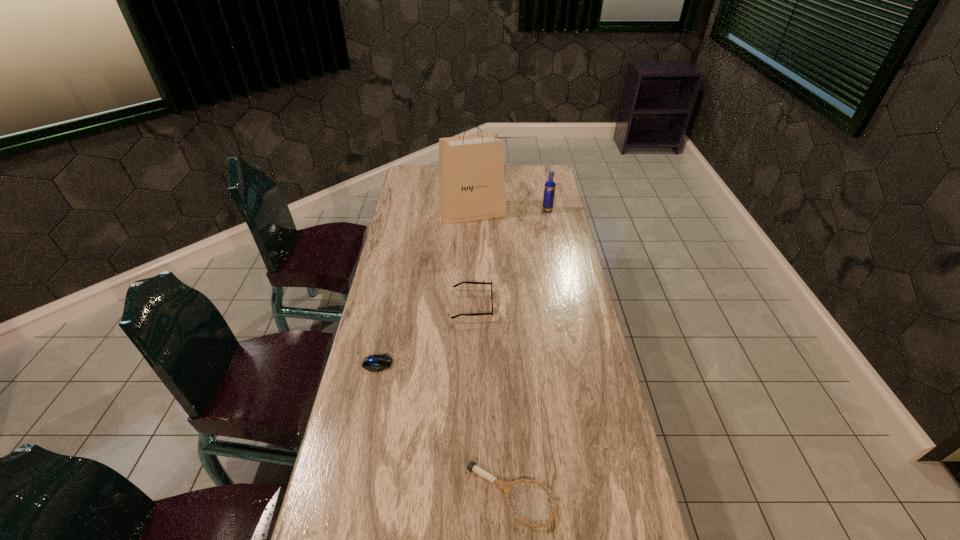
Where is `shopping bag`? The width and height of the screenshot is (960, 540). shopping bag is located at coordinates (471, 187).

Find the location of a particular element. vodka is located at coordinates (549, 189).

Locate an element on the screen. The height and width of the screenshot is (540, 960). the rightmost object is located at coordinates (549, 189).

This screenshot has width=960, height=540. In order to click on the third farthest object in this screenshot , I will do `click(473, 314)`.

The image size is (960, 540). What are the coordinates of `the third shortest object` in the screenshot? It's located at (473, 314).

Locate an element on the screen. This screenshot has width=960, height=540. tennis racket is located at coordinates (506, 487).

Identify the location of the leftmost object. The image size is (960, 540). (374, 363).

The height and width of the screenshot is (540, 960). I want to click on computer mouse, so click(x=374, y=363).

Identify the location of vacant space located on the back of the tallest object. This screenshot has height=540, width=960. (473, 175).

Identify the location of vacant space located on the back of the rightmost object. (541, 181).